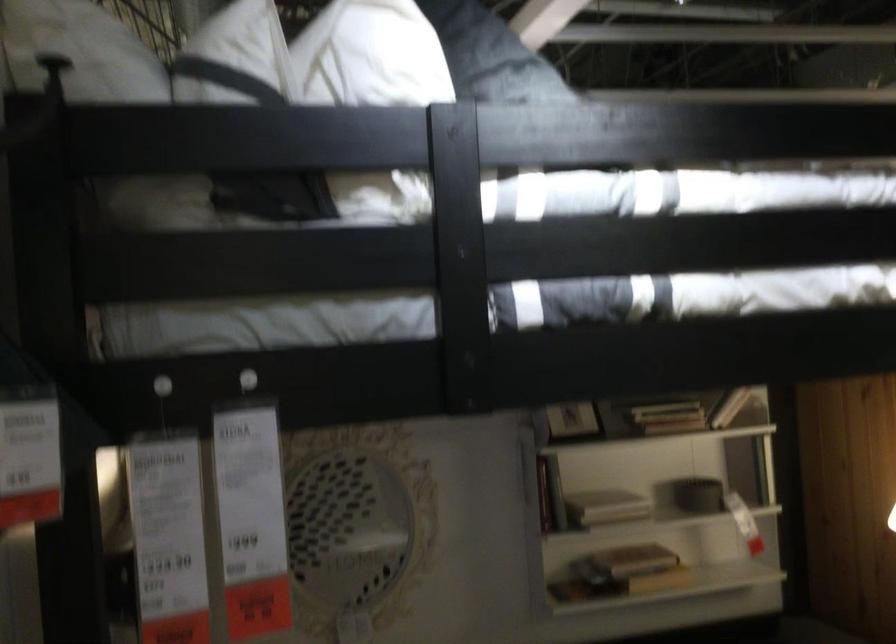
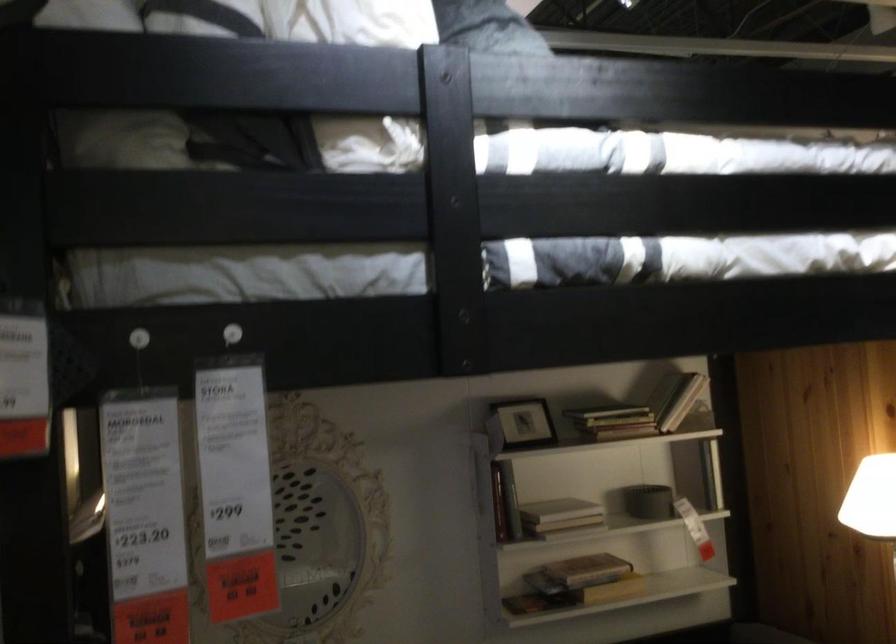
The point at (246, 380) is marked in the first image. Where is the corresponding point in the second image?

(231, 333)